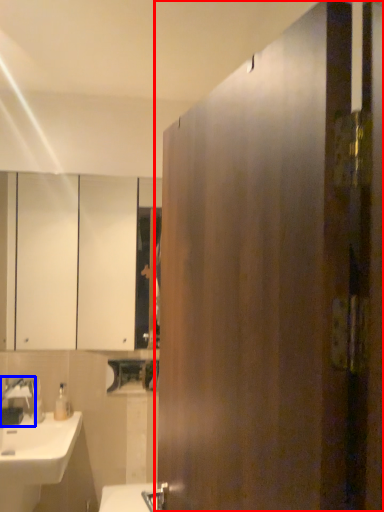
Question: Which point is closer to the camera, door (highlighted by a red box) or tap (highlighted by a blue box)?

Choices:
 (A) door
 (B) tap

Answer: (A)